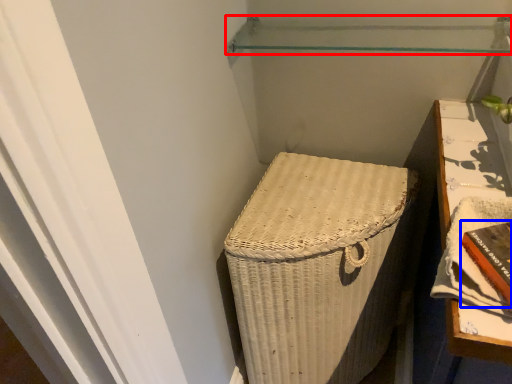
Question: Which of the following is the farthest to the observer, shelf (highlighted by a red box) or book (highlighted by a blue box)?

Choices:
 (A) shelf
 (B) book

Answer: (A)